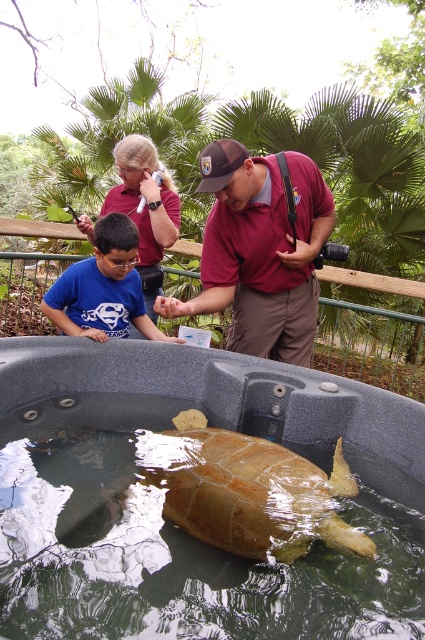
You are standing at the center of the scene and want to move towards the maroon shirt at center. Which direction should you go?

The maroon shirt at center is located at point 0.392 on the x axis and 0.612 on the y axis. Since you are at the center of the scene, you should move towards the direction of the coordinates provided to reach the maroon shirt at center.

You are a researcher observing the turtle and the boy in the sanctuary. Which object is shorter between the brown textured shell at center and the blue cotton shirt at center?

The brown textured shell at center is shorter than the blue cotton shirt at center.

You are a visitor at the sanctuary and want to know if the blue cotton shirt at center is fully visible above the translucent green water at center. Based on the scene, can you determine this?

The translucent green water at center has a greater height compared to the blue cotton shirt at center, so the blue cotton shirt at center is partially submerged in the water and not fully visible above it.